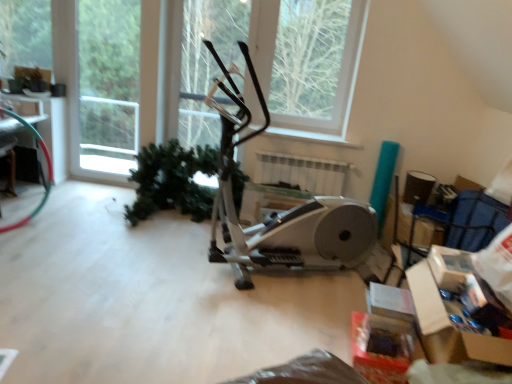
Question: In terms of height, does white plastic window frame at upper left look taller or shorter compared to white plastic radiator at center?

Choices:
 (A) short
 (B) tall

Answer: (B)

Question: In the image, is white plastic window frame at upper left on the left side or the right side of white plastic radiator at center?

Choices:
 (A) right
 (B) left

Answer: (B)

Question: Which of these objects is positioned closest to the white plastic window frame at upper left?

Choices:
 (A) cardboard box at lower right
 (B) wooden table at left
 (C) white plastic radiator at center
 (D) green matte tree at upper center, which is the first tree in right-to-left order
 (E) silver metallic stationary bicycle at center

Answer: (B)

Question: Which object is positioned closest to the silver metallic stationary bicycle at center?

Choices:
 (A) green matte tree at upper left, placed as the 1th tree when sorted from left to right
 (B) cardboard box at lower right
 (C) white plastic window frame at upper left
 (D) wooden table at left
 (E) green matte tree at upper center, the 2th tree when ordered from left to right

Answer: (B)